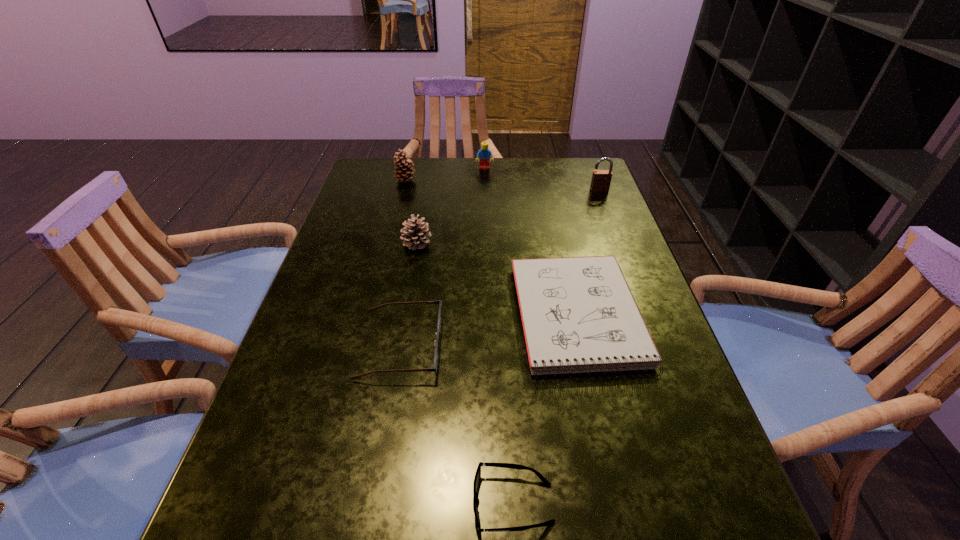
Find the location of a particular element. The height and width of the screenshot is (540, 960). pinecone that is at the far edge is located at coordinates click(405, 170).

Find the location of `Lego that is at the far edge`. Lego that is at the far edge is located at coordinates (484, 154).

Find the location of a particular element. The image size is (960, 540). pinecone situated at the left edge is located at coordinates (405, 170).

This screenshot has width=960, height=540. Identify the location of spectacles that is at the left edge. (436, 342).

Locate an element on the screen. padlock present at the right edge is located at coordinates (601, 179).

The height and width of the screenshot is (540, 960). In order to click on notepad positioned at the right edge in this screenshot , I will do `click(578, 314)`.

Locate an element on the screen. This screenshot has height=540, width=960. object at the far left corner is located at coordinates (405, 170).

The height and width of the screenshot is (540, 960). What are the coordinates of `object positioned at the far right corner` in the screenshot? It's located at (601, 179).

The image size is (960, 540). What are the coordinates of `free spot at the far edge of the desktop` in the screenshot? It's located at (507, 165).

This screenshot has height=540, width=960. In the image, there is a desktop. Find the location of `vacant space at the left edge`. vacant space at the left edge is located at coordinates (367, 202).